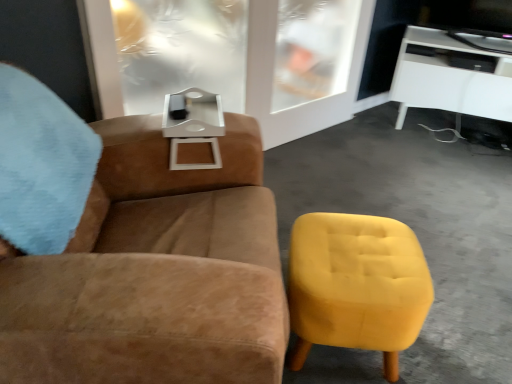
Question: From a real-world perspective, is white glossy tv stand at upper right above or below transparent glass door at upper center?

Choices:
 (A) below
 (B) above

Answer: (A)

Question: From the image's perspective, is white glossy tv stand at upper right above or below transparent glass door at upper center?

Choices:
 (A) above
 (B) below

Answer: (A)

Question: Which object is positioned farthest from the transparent glass door at upper center?

Choices:
 (A) yellow fabric ottoman at lower right
 (B) suede brown armchair at upper left
 (C) white glossy tv stand at upper right

Answer: (A)

Question: Considering the real-world distances, which object is closest to the suede brown armchair at upper left?

Choices:
 (A) transparent glass door at upper center
 (B) white glossy tv stand at upper right
 (C) yellow fabric ottoman at lower right

Answer: (C)